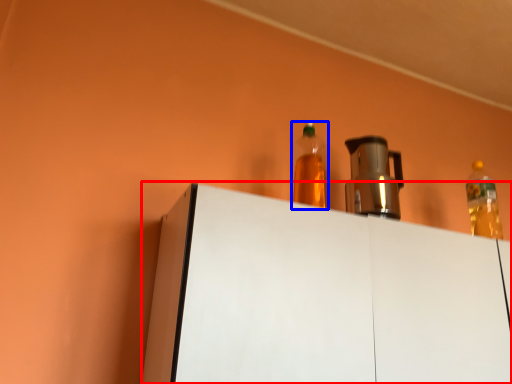
Question: Which point is closer to the camera, furniture (highlighted by a red box) or bottle (highlighted by a blue box)?

Choices:
 (A) furniture
 (B) bottle

Answer: (A)